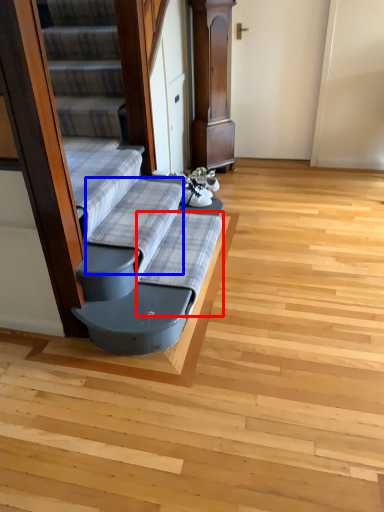
Question: Which object is further to the camera taking this photo, sheet (highlighted by a red box) or sheet (highlighted by a blue box)?

Choices:
 (A) sheet
 (B) sheet

Answer: (A)